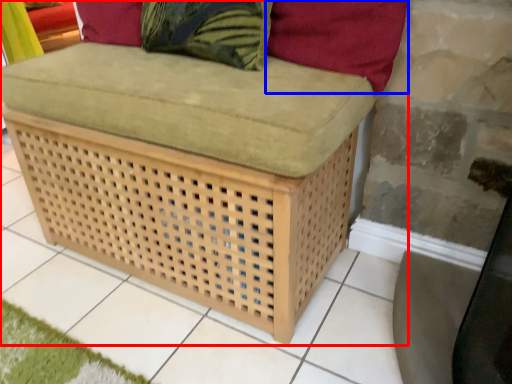
Question: Which point is closer to the camera, furniture (highlighted by a red box) or pillow (highlighted by a blue box)?

Choices:
 (A) furniture
 (B) pillow

Answer: (A)